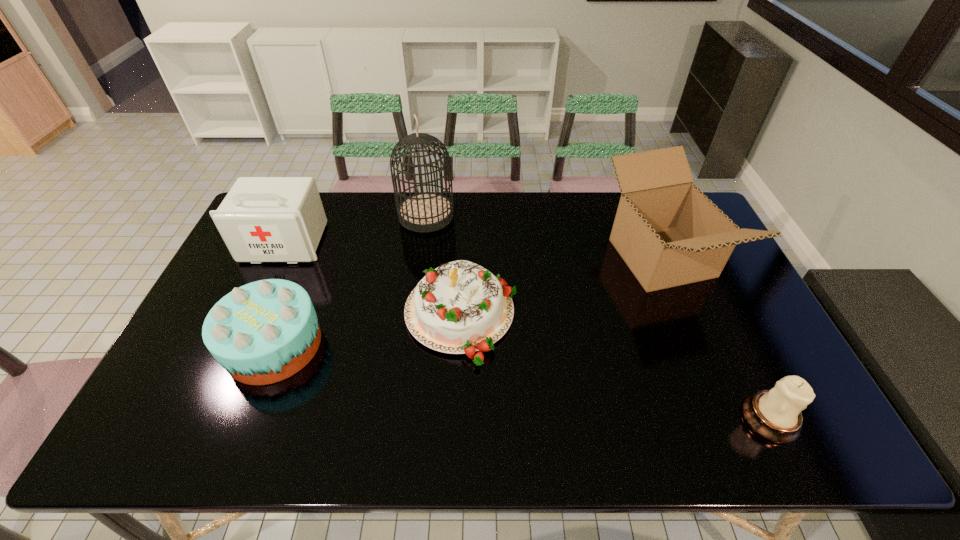
The width and height of the screenshot is (960, 540). I want to click on object present at the far left corner, so click(x=262, y=219).

This screenshot has height=540, width=960. I want to click on object that is at the far right corner, so click(669, 233).

At what (x,y) coordinates should I click in order to perform the action: click on object that is at the near right corner. Please return your answer as a coordinate pair (x, y). Looking at the image, I should click on (775, 415).

The height and width of the screenshot is (540, 960). I want to click on blank space at the far edge of the desktop, so click(587, 214).

In the image, there is a desktop. Where is `blank space at the right edge`? blank space at the right edge is located at coordinates (708, 291).

Where is `vacant area that lies between the first-aid kit and the candle holder`? The height and width of the screenshot is (540, 960). vacant area that lies between the first-aid kit and the candle holder is located at coordinates (527, 330).

Locate an element on the screen. The width and height of the screenshot is (960, 540). vacant area between the box and the candle holder is located at coordinates (715, 338).

Where is `vacant point located between the box and the right cake`? This screenshot has width=960, height=540. vacant point located between the box and the right cake is located at coordinates (562, 287).

What are the coordinates of `free space between the tallest object and the box` in the screenshot? It's located at (543, 237).

This screenshot has height=540, width=960. What are the coordinates of `free area in between the box and the first-aid kit` in the screenshot? It's located at (473, 251).